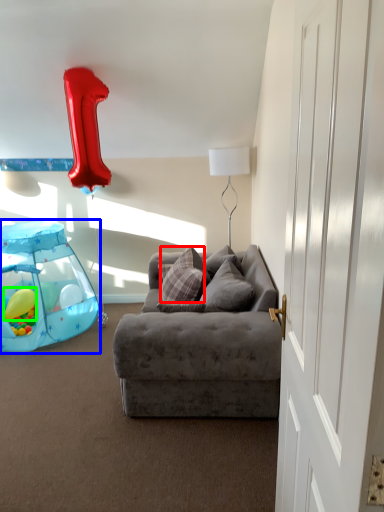
Question: Which object is the farthest from pillow (highlighted by a red box)? Choose among these: baby carriage (highlighted by a blue box) or balloon (highlighted by a green box).

Choices:
 (A) baby carriage
 (B) balloon

Answer: (B)